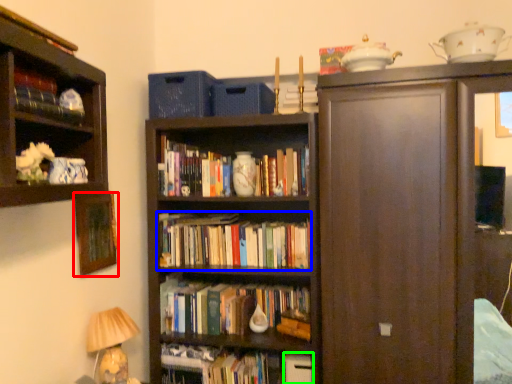
Question: Which is farther away from picture frame (highlighted by a red box)? book (highlighted by a blue box) or paperback book (highlighted by a green box)?

Choices:
 (A) book
 (B) paperback book

Answer: (B)